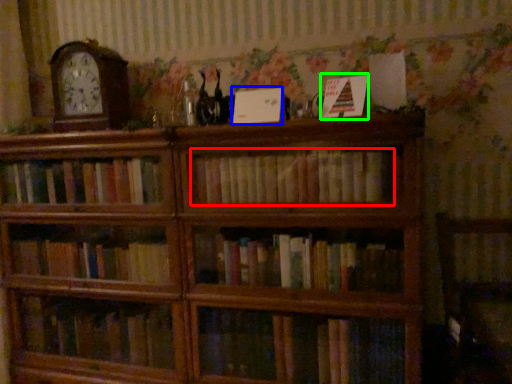
Question: Estimate the real-world distances between objects in this image. Which object is closer to book (highlighted by a red box), paperback book (highlighted by a blue box) or paperback book (highlighted by a green box)?

Choices:
 (A) paperback book
 (B) paperback book

Answer: (A)